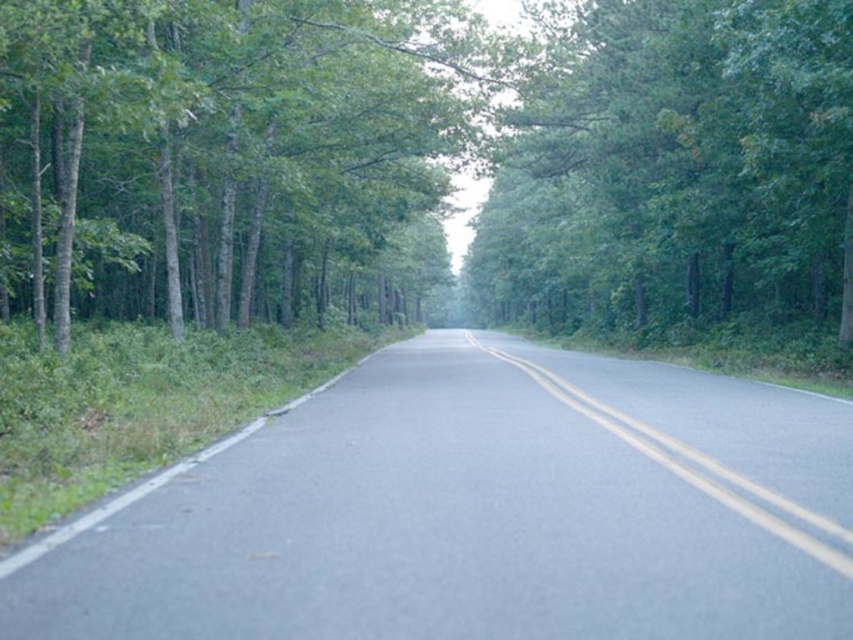
You are driving a car on the two lane road through the forest. You see two points marked on the road ahead. One is at point (543,120) and the other is at point (575,406). Which point is closer to your current position?

Point (575,406) is closer to your current position because point (543,120) is behind it.

You are a drone operator who needs to fly a drone from the starting point at the bottom of the image to the green leafy tree at upper center. According to the coordinates provided, what is the direction you should fly the drone to reach the tree?

The green leafy tree at upper center is located at coordinates [676,170]. Since the x and y coordinates are both greater than the starting point at the bottom, you should fly the drone upward and to the left to reach the tree.